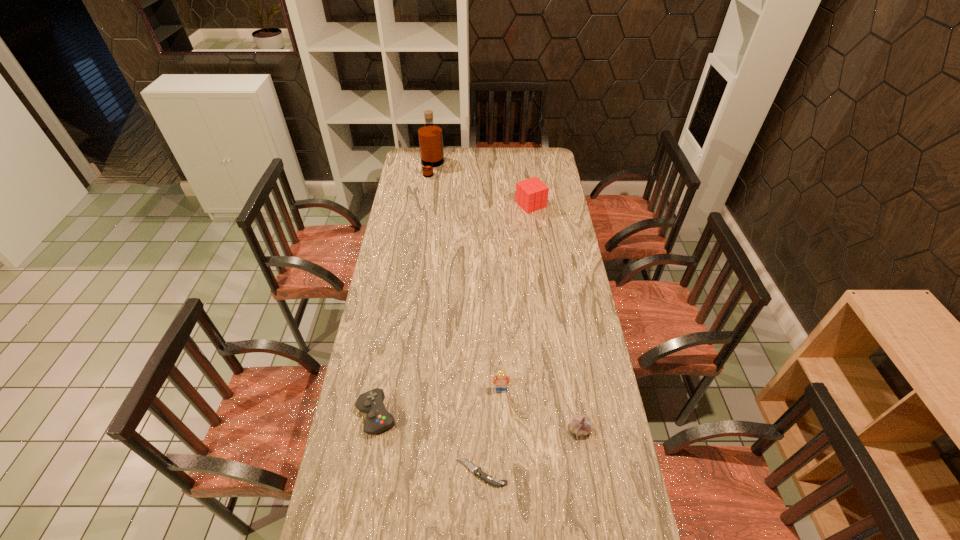
This screenshot has height=540, width=960. I want to click on free space between the Lego and the cube, so click(x=516, y=297).

The width and height of the screenshot is (960, 540). In order to click on free space between the fifth nearest object and the third farthest object in this screenshot , I will do click(516, 297).

The image size is (960, 540). In order to click on free spot between the second shortest object and the third shortest object in this screenshot , I will do `click(478, 422)`.

Image resolution: width=960 pixels, height=540 pixels. Find the location of `object that is the fifth closest to the fifth nearest object`. object that is the fifth closest to the fifth nearest object is located at coordinates (489, 479).

This screenshot has height=540, width=960. I want to click on object that is the second closest to the third shortest object, so click(x=489, y=479).

Locate an element on the screen. The height and width of the screenshot is (540, 960). free space in the image that satisfies the following two spatial constraints: 1. on the front label of the pocketknife; 2. on the left side of the tallest object is located at coordinates (390, 472).